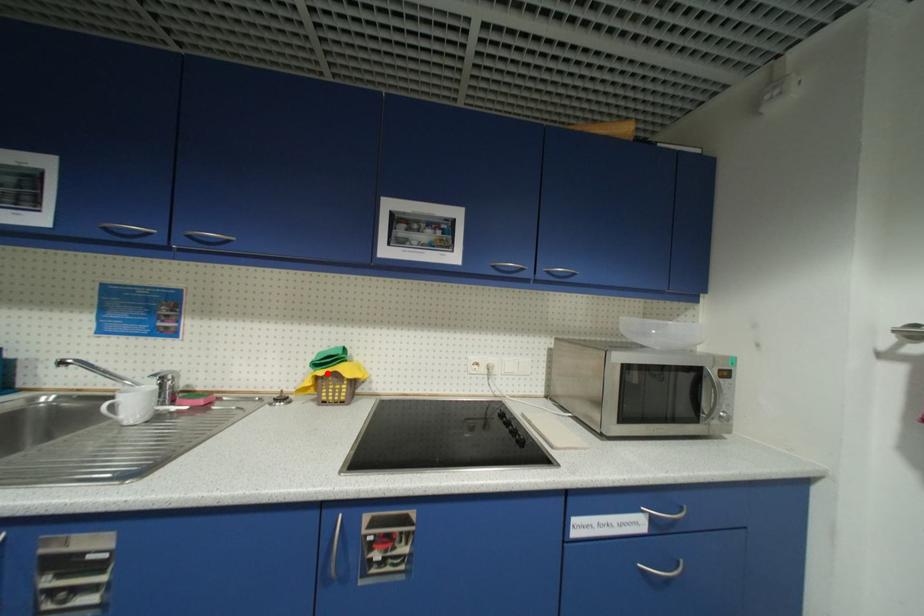
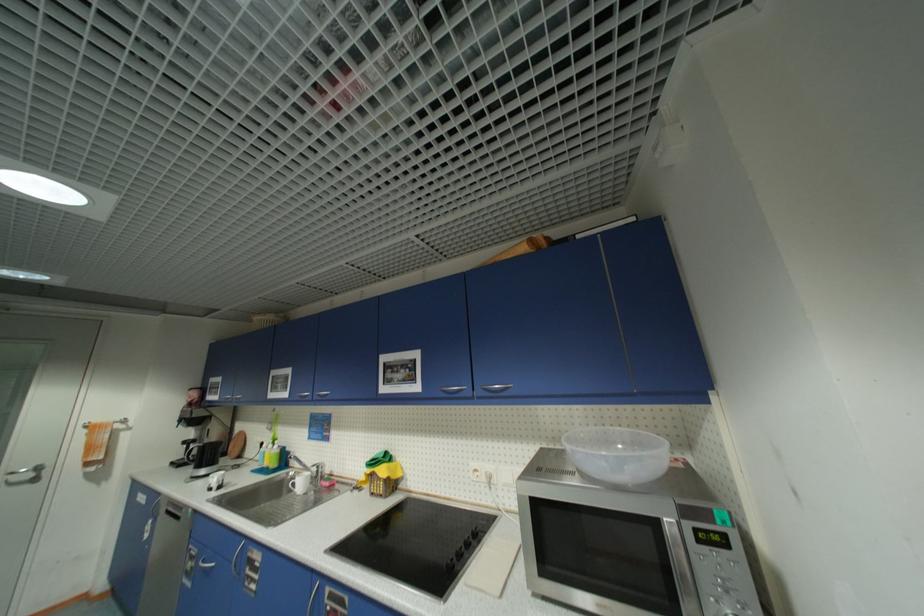
Question: I am providing you with two images of the same scene from different viewpoints. A red point is shown in image1. For the corresponding object point in image2, is it positioned nearer or farther from the camera?

Choices:
 (A) Nearer
 (B) Farther

Answer: (B)